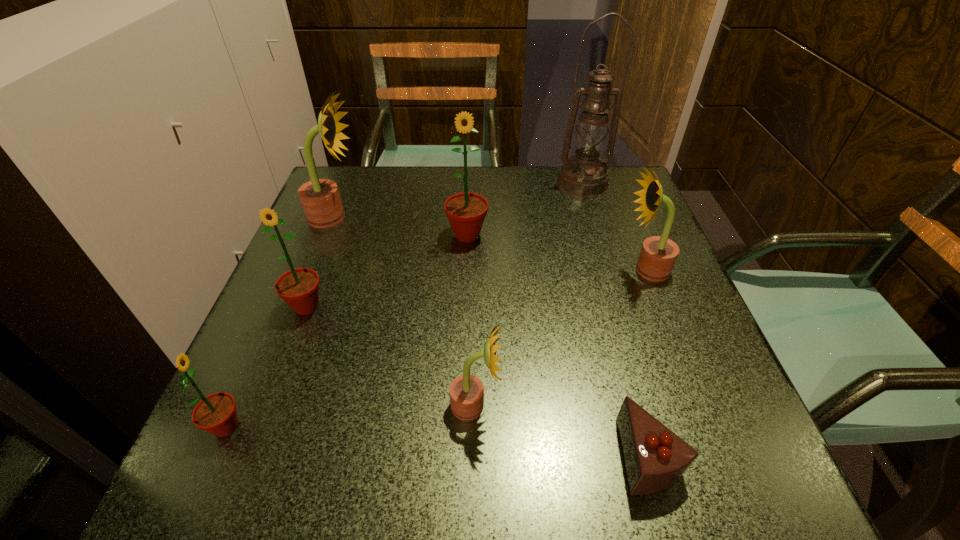
What are the coordinates of `chocolate cake that is at the right edge` in the screenshot? It's located at (655, 458).

In order to click on object that is at the far left corner in this screenshot , I will do tap(320, 198).

The height and width of the screenshot is (540, 960). I want to click on object that is at the near left corner, so click(x=216, y=413).

In order to click on object positioned at the far right corner in this screenshot , I will do [584, 175].

Identify the location of object that is at the near right corner. (655, 458).

Find the location of a particular element. The width and height of the screenshot is (960, 540). vacant area at the far edge is located at coordinates (561, 194).

Locate an element on the screen. The height and width of the screenshot is (540, 960). vacant space at the near edge of the desktop is located at coordinates (466, 451).

Identify the location of free space at the left edge of the desktop. (305, 390).

Image resolution: width=960 pixels, height=540 pixels. Find the location of `free region at the right edge`. free region at the right edge is located at coordinates (621, 299).

In the image, there is a desktop. At what (x,y) coordinates should I click in order to perform the action: click on vacant space at the far left corner. Please return your answer as a coordinate pair (x, y). Image resolution: width=960 pixels, height=540 pixels. Looking at the image, I should click on (360, 215).